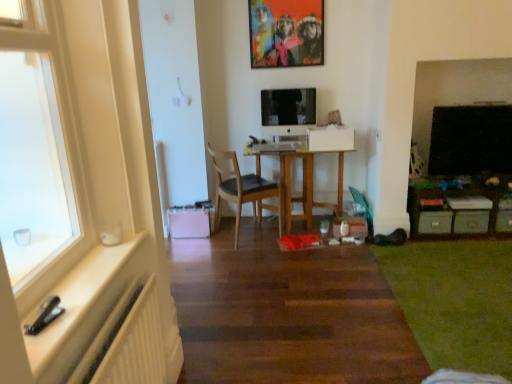
Identify the location of vacant space situated above black plastic stapler at left (from a real-world perspective). Image resolution: width=512 pixels, height=384 pixels. (x=98, y=261).